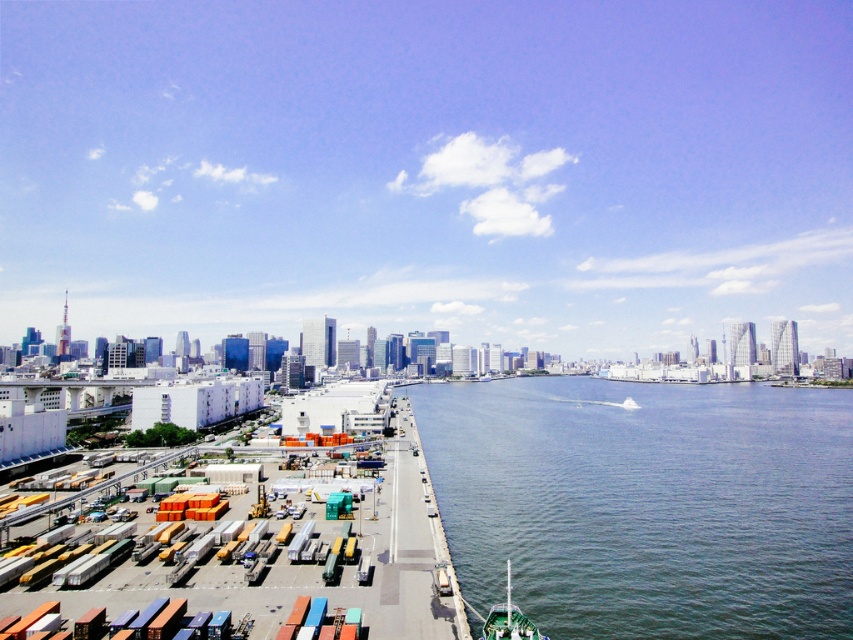
You are standing at the waterfront and want to locate two points marked on the map. The first point is at coordinate point(630, 584) and the second is at point(521, 632). From your current position, which point is closer to you?

Point(521, 632) is closer to you because it is in front of point(630, 584).